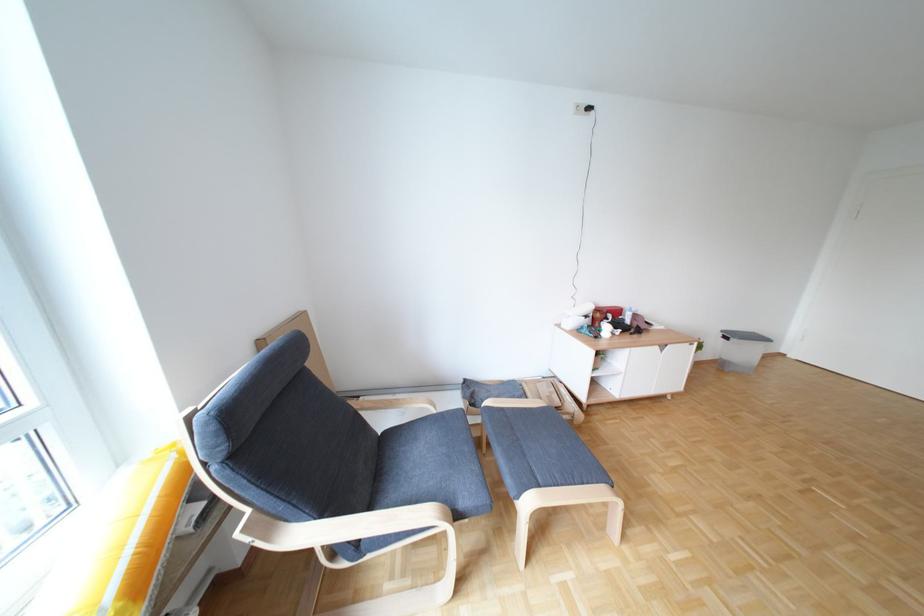
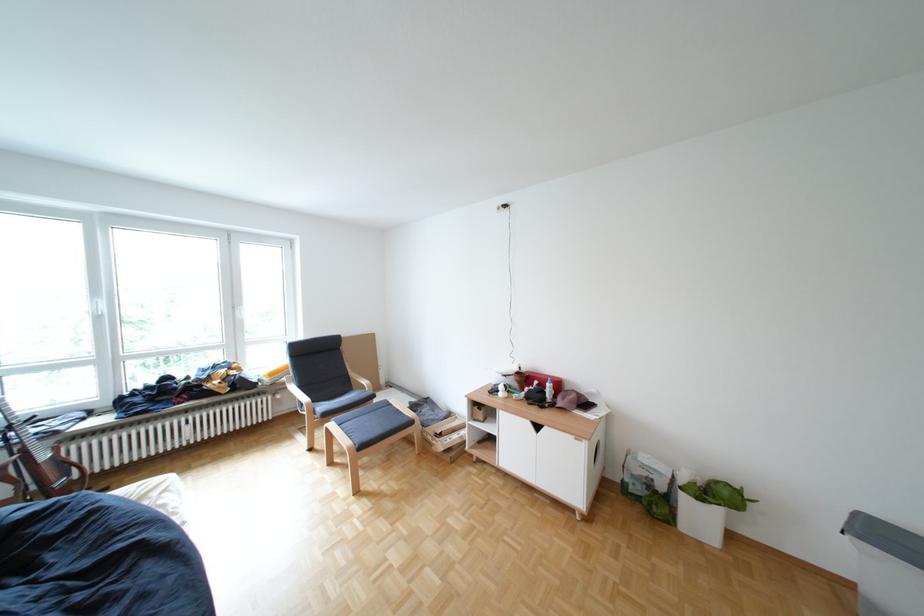
Where in the second image is the point corresponding to point 625,315 from the first image?

(552, 383)